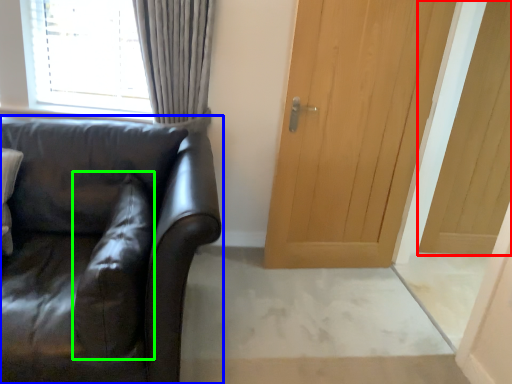
Question: Which object is the farthest from door (highlighted by a red box)? Choose among these: studio couch (highlighted by a blue box) or pillow (highlighted by a green box).

Choices:
 (A) studio couch
 (B) pillow

Answer: (B)